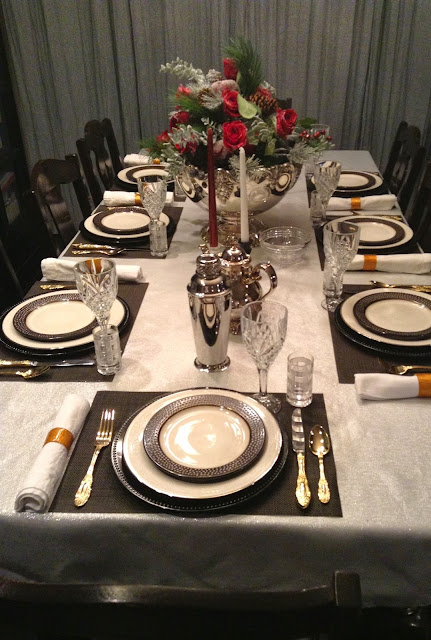
Find the location of a particular element. The height and width of the screenshot is (640, 431). napkins is located at coordinates (343, 196), (375, 262), (381, 381), (61, 461), (59, 271), (107, 211), (133, 157).